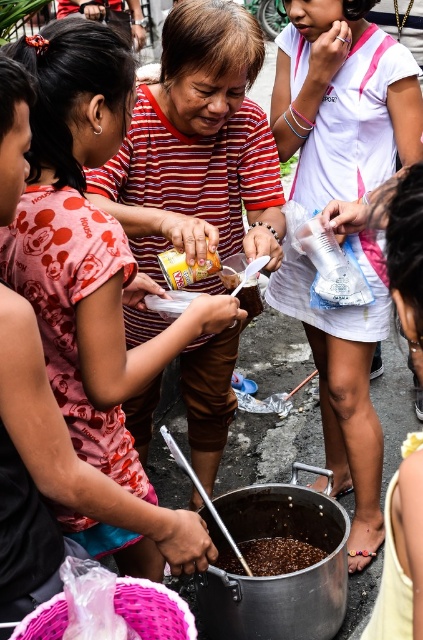
This screenshot has height=640, width=423. Identify the location of striped fabric shirt at center. (197, 147).

Between striped fabric shirt at center and white cotton shirt at center, which one appears on the right side from the viewer's perspective?

white cotton shirt at center

Where is `striped fabric shirt at center`? The height and width of the screenshot is (640, 423). striped fabric shirt at center is located at coordinates (197, 147).

Who is positioned more to the left, striped fabric shirt at center or brown matte rice at center?

striped fabric shirt at center is more to the left.

Describe the element at coordinates (197, 147) in the screenshot. I see `striped fabric shirt at center` at that location.

The image size is (423, 640). What are the coordinates of `striped fabric shirt at center` in the screenshot? It's located at (197, 147).

From the picture: Is white cotton shirt at center in front of brown matte rice at center?

Yes.

Who is shorter, white cotton shirt at center or brown matte rice at center?

brown matte rice at center

Between point (277, 276) and point (290, 570), which one is positioned in front?

Point (290, 570) is in front.

Find the location of a particular element. white cotton shirt at center is located at coordinates (343, 100).